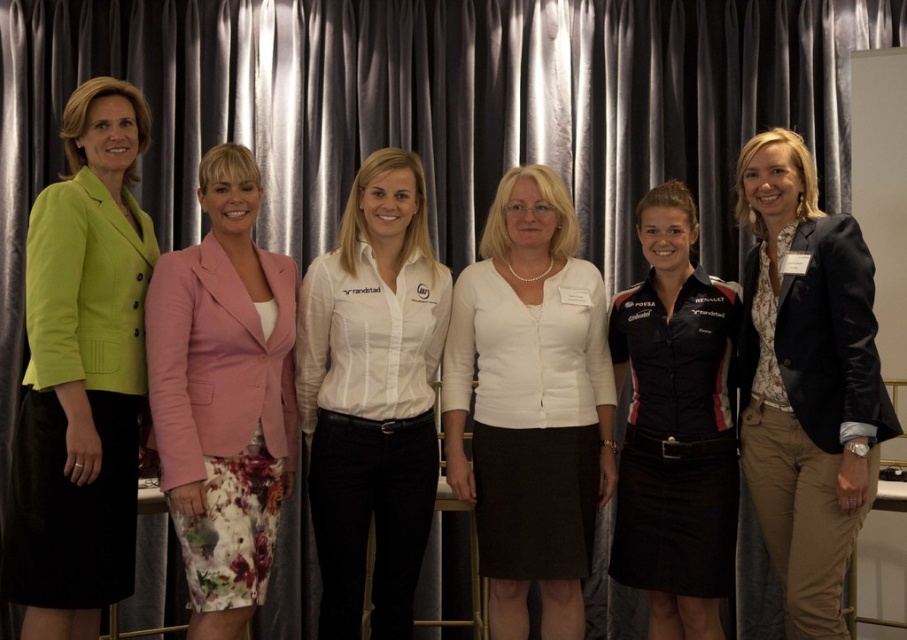
Question: Can you confirm if lime green fabric jacket at left is bigger than black jersey at center?

Choices:
 (A) yes
 (B) no

Answer: (A)

Question: Can you confirm if lime green fabric jacket at left is bigger than white shirt at center?

Choices:
 (A) no
 (B) yes

Answer: (B)

Question: Can you confirm if pink fabric skirt at center is thinner than black jersey at center?

Choices:
 (A) no
 (B) yes

Answer: (B)

Question: Which of the following is the farthest from the observer?

Choices:
 (A) (667, 211)
 (B) (549, 561)
 (C) (193, 609)

Answer: (A)

Question: Estimate the real-world distances between objects in this image. Which object is closer to the navy blue blazer at center?

Choices:
 (A) black jersey at center
 (B) lime green fabric jacket at left

Answer: (A)

Question: Which of the following is the farthest from the observer?

Choices:
 (A) (504, 355)
 (B) (876, 378)
 (C) (258, 312)

Answer: (A)